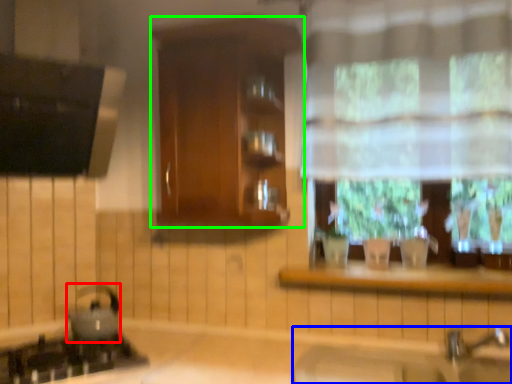
Question: Based on their relative distances, which object is nearer to appliance (highlighted by a red box)? Choose from sink (highlighted by a blue box) and cabinetry (highlighted by a green box).

Choices:
 (A) sink
 (B) cabinetry

Answer: (B)